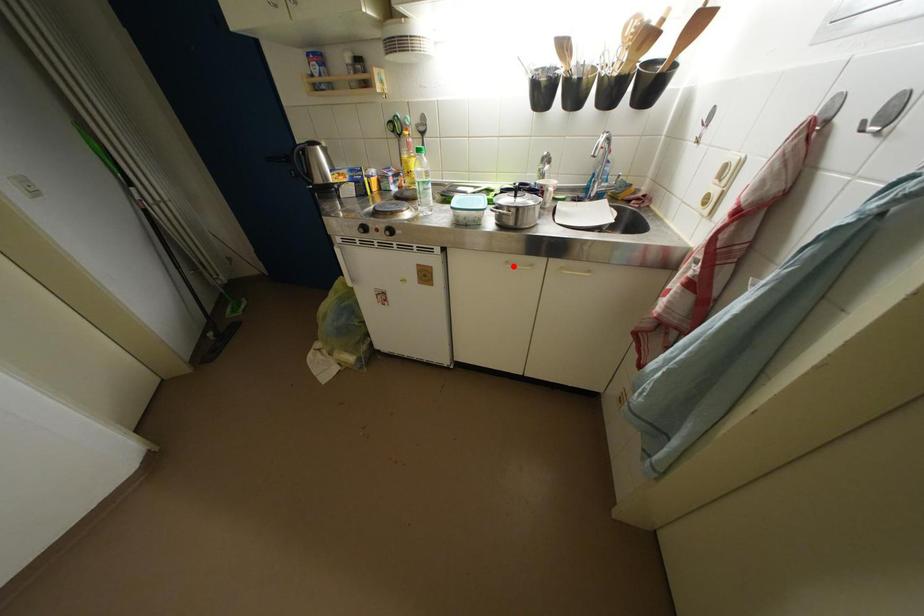
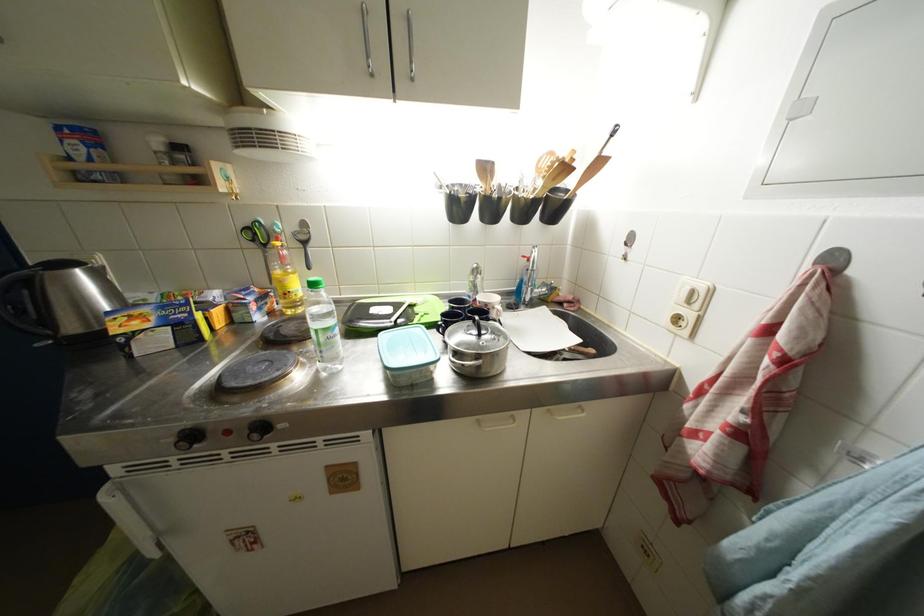
Question: A red point is marked in image1. In image2, is the corresponding 3D point closer to the camera or farther? Reply with the corresponding letter.

Choices:
 (A) The corresponding 3D point is closer.
 (B) The corresponding 3D point is farther.

Answer: (B)